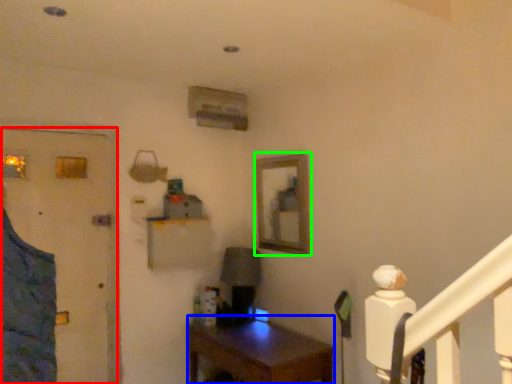
Question: Estimate the real-world distances between objects in this image. Which object is farther from door (highlighted by a red box), desk (highlighted by a blue box) or picture frame (highlighted by a green box)?

Choices:
 (A) desk
 (B) picture frame

Answer: (B)